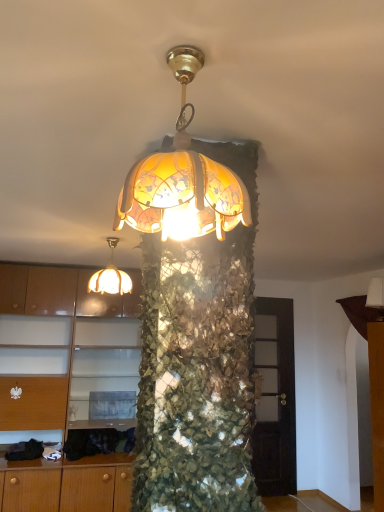
Question: Considering the positions of point (92, 287) and point (375, 301), is point (92, 287) closer or farther from the camera than point (375, 301)?

Choices:
 (A) closer
 (B) farther

Answer: (A)

Question: Is translucent glass lampshade at upper center, which is the 2th lamp in front-to-back order, situated inside white fabric lampshade at upper right, the 3th lamp in the left-to-right sequence, or outside?

Choices:
 (A) inside
 (B) outside

Answer: (B)

Question: Estimate the real-world distances between objects in this image. Which object is closer to the matte wood cabinet at left?

Choices:
 (A) white fabric lampshade at upper right, the 3th lamp in the left-to-right sequence
 (B) translucent glass lampshade at upper center, which is the 3th lamp in right-to-left order
 (C) translucent glass lampshade at center, the 2th lamp in the left-to-right sequence

Answer: (B)

Question: Estimate the real-world distances between objects in this image. Which object is closer to the translucent glass lampshade at upper center, which ranks as the first lamp in left-to-right order?

Choices:
 (A) white fabric lampshade at upper right, the 3th lamp in the left-to-right sequence
 (B) matte wood cabinet at left
 (C) translucent glass lampshade at center, the second lamp when ordered from right to left

Answer: (B)